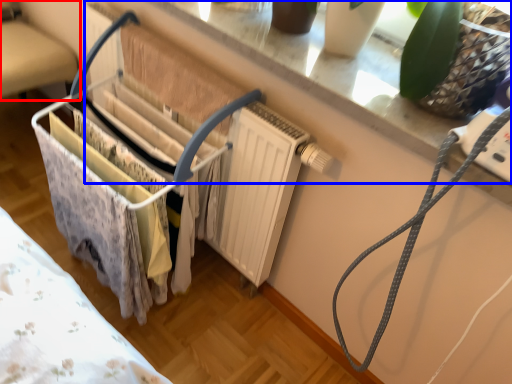
Question: Which object is closer to the camera taking this photo, furniture (highlighted by a red box) or window sill (highlighted by a blue box)?

Choices:
 (A) furniture
 (B) window sill

Answer: (B)